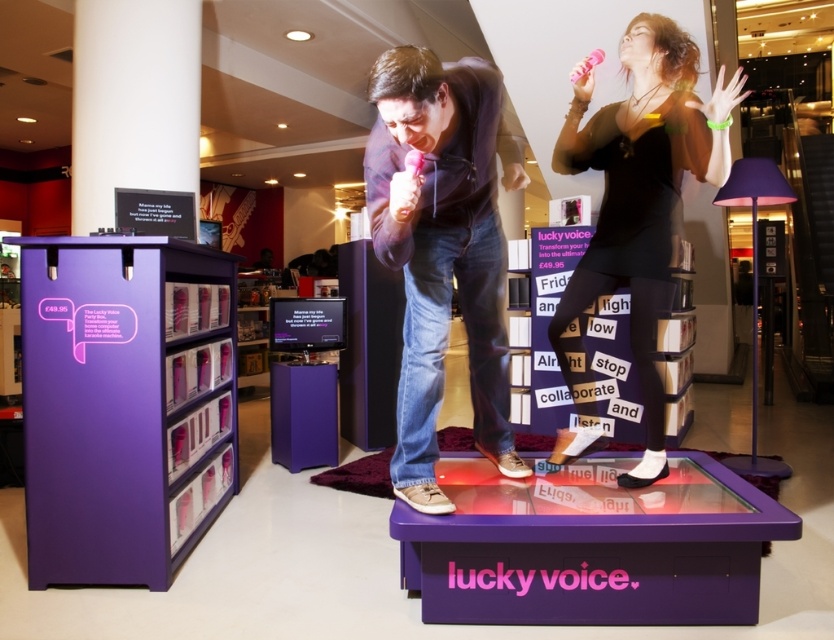
Between purple matte bookshelf at left and matte black microphone at center, which one appears on the left side from the viewer's perspective?

Positioned to the left is purple matte bookshelf at left.

Based on the photo, is purple matte bookshelf at left positioned before matte black microphone at center?

No, purple matte bookshelf at left is further to the viewer.

Is point (156, 566) less distant than point (460, 106)?

No, (156, 566) is behind (460, 106).

Image resolution: width=834 pixels, height=640 pixels. Identify the location of purple matte bookshelf at left. pos(124,403).

Between matte black microphone at center and black matte dress at center, which one is positioned higher?

black matte dress at center is higher up.

Who is more forward, (471, 365) or (647, 22)?

Point (647, 22) is in front.

I want to click on matte black microphone at center, so click(440, 252).

Is point (189, 250) closer to camera compared to point (610, 176)?

No.

Can you confirm if purple matte bookshelf at left is wider than black matte dress at center?

No.

Locate an element on the screen. The image size is (834, 640). purple matte bookshelf at left is located at coordinates (124, 403).

The image size is (834, 640). I want to click on purple matte bookshelf at left, so click(124, 403).